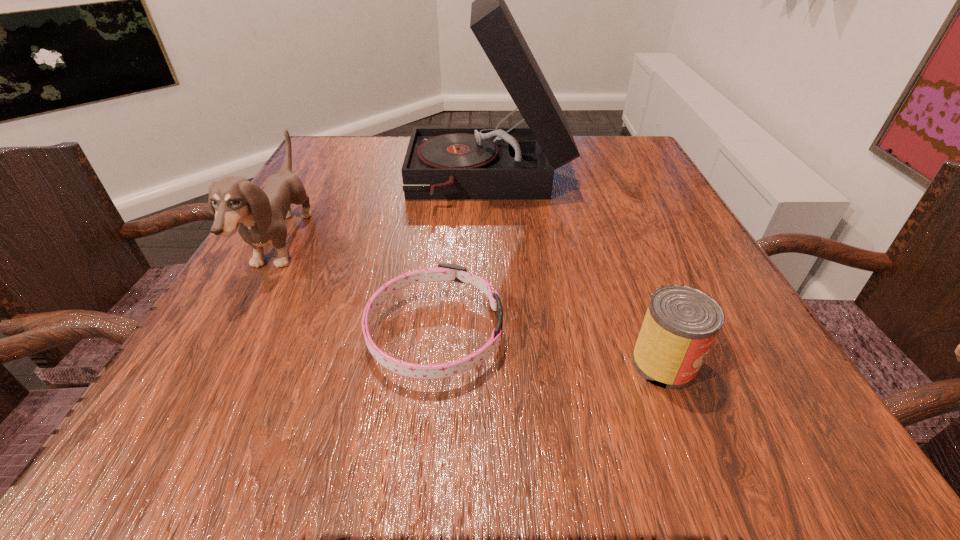
The image size is (960, 540). Find the location of `vacant space at the far left corner of the desktop`. vacant space at the far left corner of the desktop is located at coordinates (355, 145).

In the image, there is a desktop. Where is `vacant space at the near left corner`? This screenshot has height=540, width=960. vacant space at the near left corner is located at coordinates (145, 426).

Image resolution: width=960 pixels, height=540 pixels. In the image, there is a desktop. Find the location of `vacant space at the far right corner`. vacant space at the far right corner is located at coordinates (604, 178).

Where is `vacant area at the near right corner of the desktop`? Image resolution: width=960 pixels, height=540 pixels. vacant area at the near right corner of the desktop is located at coordinates (765, 437).

Where is `vacant space that is in between the third shortest object and the shortest object`? The width and height of the screenshot is (960, 540). vacant space that is in between the third shortest object and the shortest object is located at coordinates (358, 289).

Where is `unoccupied position between the can and the leftmost object`? unoccupied position between the can and the leftmost object is located at coordinates (472, 304).

Locate an element on the screen. This screenshot has width=960, height=540. empty location between the shortest object and the leftmost object is located at coordinates (358, 289).

You are a GUI agent. You are given a task and a screenshot of the screen. Output one action in this format:
    pyautogui.click(x=<x>, y=<y>)
    Task: Click on the blank region between the leftmost object and the shortest object
    This screenshot has height=540, width=960.
    Given the screenshot: What is the action you would take?
    pyautogui.click(x=358, y=289)

Where is `free space between the shortest object and the tallest object`? This screenshot has width=960, height=540. free space between the shortest object and the tallest object is located at coordinates (462, 258).

I want to click on free space between the shortest object and the rightmost object, so click(x=549, y=348).